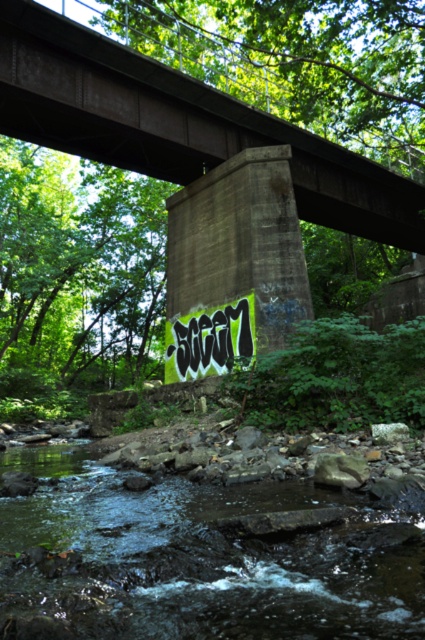
Is green mossy rock at lower center below concrete at center?

Yes.

Is point (263, 486) positioned in front of point (340, 224)?

That is True.

The height and width of the screenshot is (640, 425). What are the coordinates of `green mossy rock at lower center` in the screenshot? It's located at (201, 557).